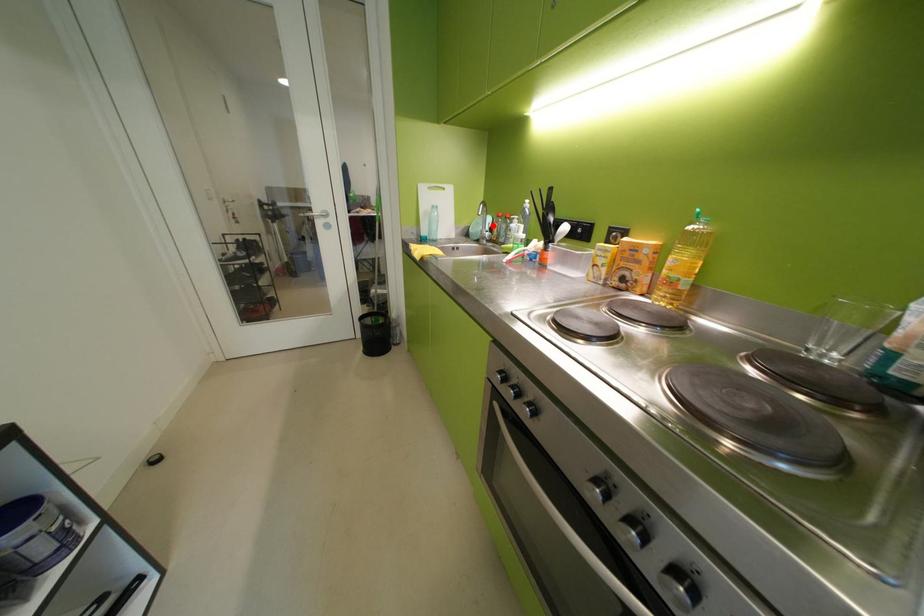
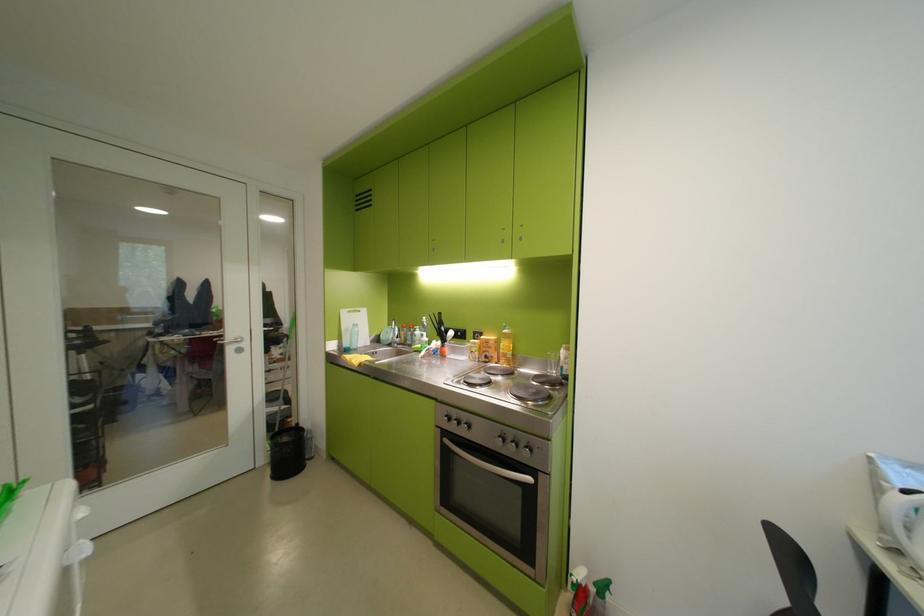
Question: I am providing you with two images of the same scene from different viewpoints. A red point is shown in image1. For the corresponding object point in image2, is it positioned nearer or farther from the camera?

Choices:
 (A) Nearer
 (B) Farther

Answer: (B)